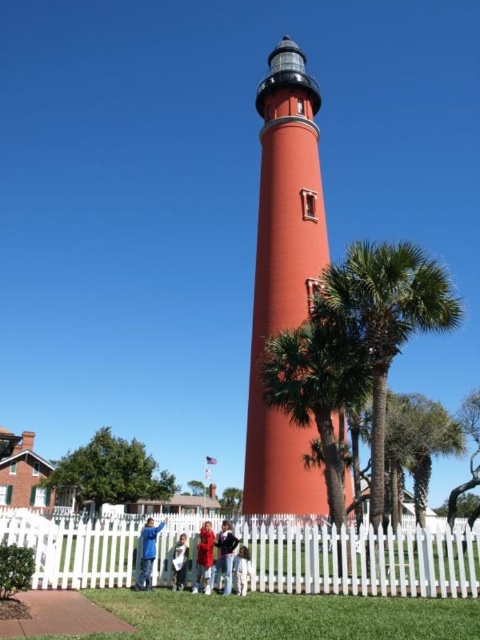
You are standing in front of the lighthouse and want to take a photo. There are two points marked on the ground where you can stand. The first point is at coordinates point (146,528) and the second is at point (216,547). Which point is closer to you?

Point (146,528) is further to the camera than point (216,547). Wait, but the question asks which is closer to you. Since point (146,528) is further away, the closer one would be point (216,547).

You are a visitor at the lighthouse and notice two items on the ground. You see a blue denim jacket at lower center and a red fabric coat at center. Which item is closer to the lighthouse?

The blue denim jacket at lower center is closer to the lighthouse because it is located above the red fabric coat at center, which is further away.